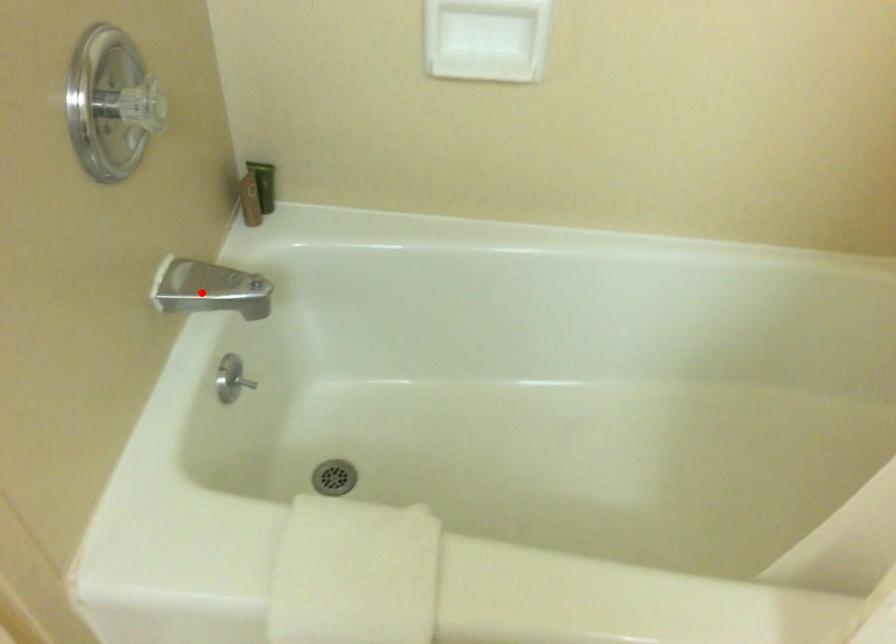
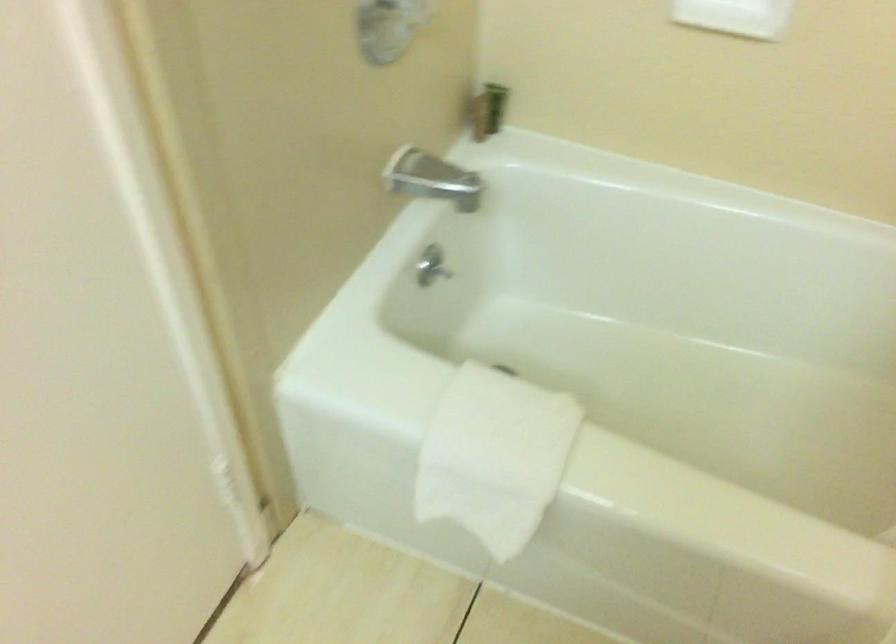
Question: A red point is marked in image1. In image2, is the corresponding 3D point closer to the camera or farther? Reply with the corresponding letter.

Choices:
 (A) The corresponding 3D point is closer.
 (B) The corresponding 3D point is farther.

Answer: (B)